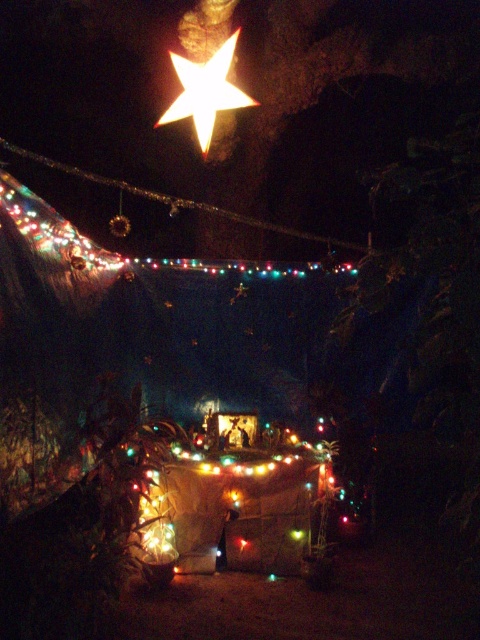
Can you confirm if bright white paper star at upper center is positioned to the left of multicolored lights at upper center?

In fact, bright white paper star at upper center is to the right of multicolored lights at upper center.

Can you confirm if bright white paper star at upper center is taller than multicolored lights at upper center?

Correct, bright white paper star at upper center is much taller as multicolored lights at upper center.

Is point (202, 129) farther from viewer compared to point (120, 186)?

No, it is in front of (120, 186).

Locate an element on the screen. bright white paper star at upper center is located at coordinates (205, 92).